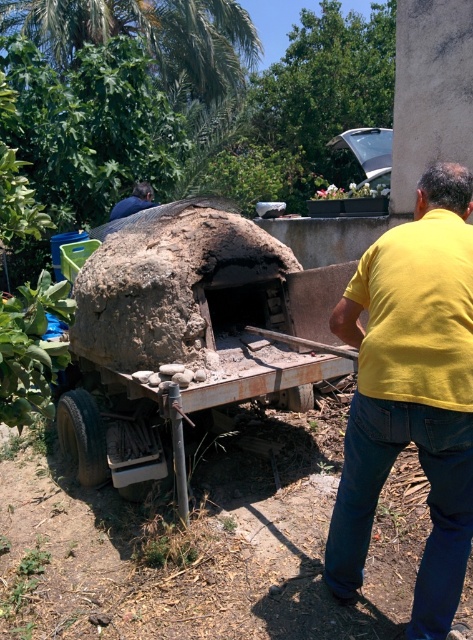
You are a tailor examining two shirts in an outdoor market. The shirts are the yellow cotton shirt at center and the yellow matte shirt at upper right. Which shirt has a greater width?

The yellow cotton shirt at center has a greater width than the yellow matte shirt at upper right.

You are standing at the origin point of the image. Which direction should you move to reach the yellow cotton shirt at center?

The yellow cotton shirt at center is located at coordinates point (411,394), so you should move towards the right and down to reach it.